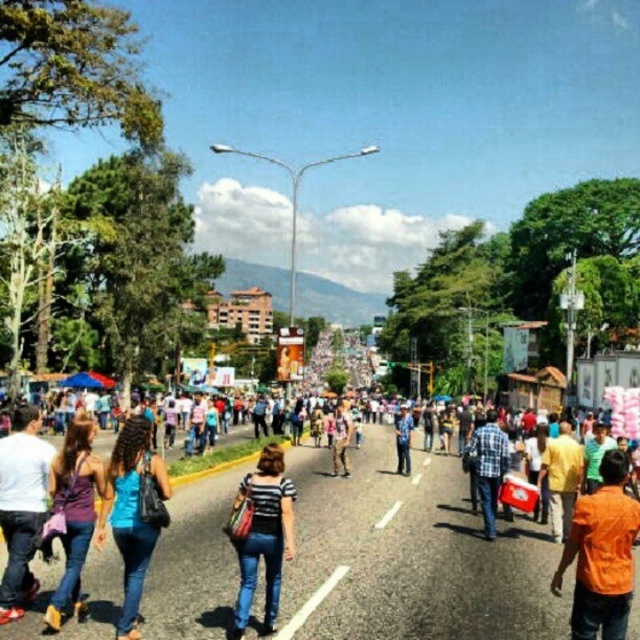
Is multicolored fabric crowd at center thinner than camouflage-patterned pants at center?

In fact, multicolored fabric crowd at center might be wider than camouflage-patterned pants at center.

Between multicolored fabric crowd at center and camouflage-patterned pants at center, which one has less height?

multicolored fabric crowd at center is shorter.

In order to click on multicolored fabric crowd at center in this screenshot , I will do `click(410, 556)`.

Where is `multicolored fabric crowd at center`? This screenshot has width=640, height=640. multicolored fabric crowd at center is located at coordinates (410, 556).

Between multicolored fabric crowd at center and blue plaid shirt at center, which one has more height?

Standing taller between the two is blue plaid shirt at center.

Can you confirm if multicolored fabric crowd at center is positioned to the right of blue plaid shirt at center?

In fact, multicolored fabric crowd at center is to the left of blue plaid shirt at center.

Is point (317, 595) positioned before point (403, 472)?

Yes.

Locate an element on the screen. The height and width of the screenshot is (640, 640). multicolored fabric crowd at center is located at coordinates (410, 556).

Does orange fabric shirt at lower right have a smaller size compared to denim jeans at lower left?

Actually, orange fabric shirt at lower right might be larger than denim jeans at lower left.

This screenshot has width=640, height=640. Describe the element at coordinates (602, 554) in the screenshot. I see `orange fabric shirt at lower right` at that location.

Is point (628, 545) positioned after point (26, 412)?

No, it is not.

I want to click on orange fabric shirt at lower right, so click(x=602, y=554).